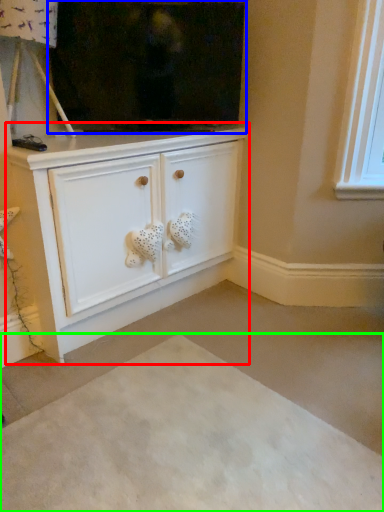
Question: Based on their relative distances, which object is nearer to cabinetry (highlighted by a red box)? Choose from fireplace (highlighted by a blue box) and plain (highlighted by a green box).

Choices:
 (A) fireplace
 (B) plain

Answer: (A)